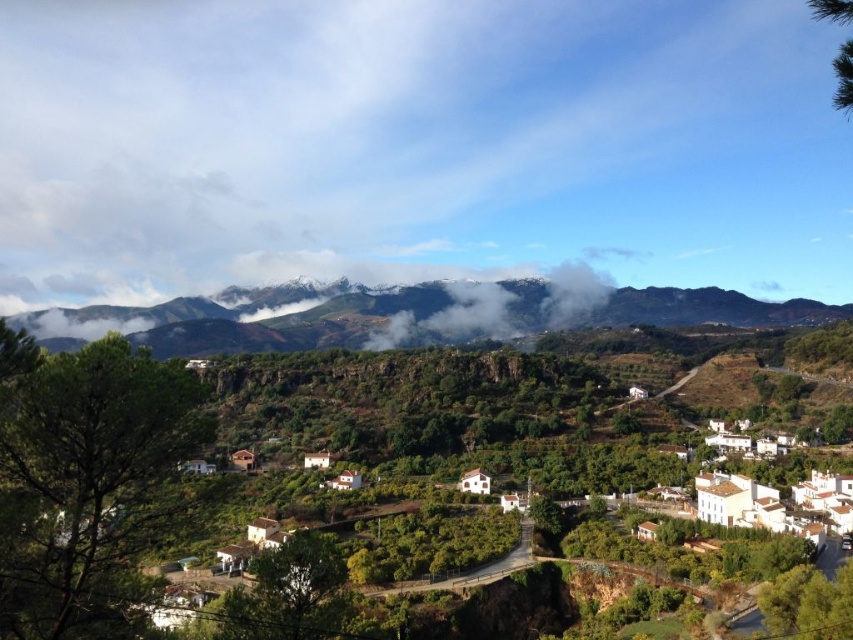
Question: Among these objects, which one is nearest to the camera?

Choices:
 (A) snow-covered mountain at upper center
 (B) white fluffy cloud at center

Answer: (A)

Question: Is snow-covered mountain at upper center above white fluffy cloud at center?

Choices:
 (A) yes
 (B) no

Answer: (B)

Question: Does snow-covered mountain at upper center appear over white fluffy cloud at center?

Choices:
 (A) yes
 (B) no

Answer: (B)

Question: Can you confirm if snow-covered mountain at upper center is positioned to the right of white fluffy cloud at center?

Choices:
 (A) no
 (B) yes

Answer: (A)

Question: Which object appears closest to the camera in this image?

Choices:
 (A) snow-covered mountain at upper center
 (B) white fluffy cloud at center

Answer: (A)